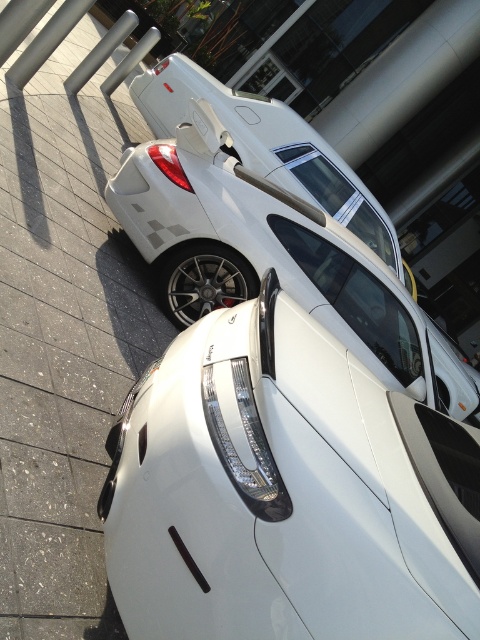
Question: Is white glossy car at center to the right of white glossy car at upper center from the viewer's perspective?

Choices:
 (A) no
 (B) yes

Answer: (B)

Question: Which point appears farthest from the camera in this image?

Choices:
 (A) (211, 84)
 (B) (204, 480)

Answer: (A)

Question: Does white glossy car at center appear on the right side of white glossy car at upper center?

Choices:
 (A) yes
 (B) no

Answer: (A)

Question: Can you confirm if white glossy car at center is positioned below white glossy car at upper center?

Choices:
 (A) no
 (B) yes

Answer: (B)

Question: Which of the following is the closest to the observer?

Choices:
 (A) (465, 563)
 (B) (267, 145)

Answer: (A)